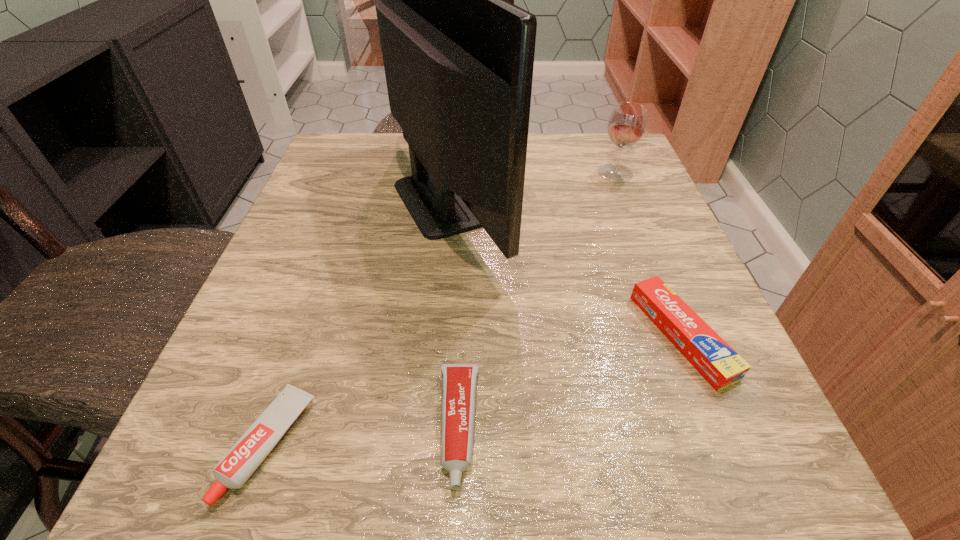
In the image, there is a desktop. At what (x,y) coordinates should I click in order to perform the action: click on free space at the far left corner. Please return your answer as a coordinate pair (x, y). Looking at the image, I should click on (325, 183).

In the image, there is a desktop. What are the coordinates of `vacant space at the near left corner` in the screenshot? It's located at (252, 480).

In the image, there is a desktop. What are the coordinates of `vacant space at the far right corner` in the screenshot? It's located at (584, 172).

You are a GUI agent. You are given a task and a screenshot of the screen. Output one action in this format:
    pyautogui.click(x=<x>, y=<y>)
    Task: Click on the blank region between the fourth shortest object and the second toothpaste from left to right
    Image resolution: width=960 pixels, height=540 pixels.
    Given the screenshot: What is the action you would take?
    pyautogui.click(x=537, y=300)

The image size is (960, 540). In order to click on unoccupied position between the second toothpaste from right to left and the leftmost object in this screenshot , I will do `click(364, 435)`.

This screenshot has height=540, width=960. Find the location of `vacant space in between the tallest object and the leftmost object`. vacant space in between the tallest object and the leftmost object is located at coordinates pos(359,322).

Locate an element on the screen. The height and width of the screenshot is (540, 960). free space between the computer monitor and the leftmost object is located at coordinates (359, 322).

Where is `vacant point located between the leftmost object and the second toothpaste from right to left`? vacant point located between the leftmost object and the second toothpaste from right to left is located at coordinates (364, 435).

Where is `free spot between the leftmost object and the tallest object`? free spot between the leftmost object and the tallest object is located at coordinates [359, 322].

Find the location of a particular element. unoccupied area between the tallest object and the leftmost toothpaste is located at coordinates (359, 322).